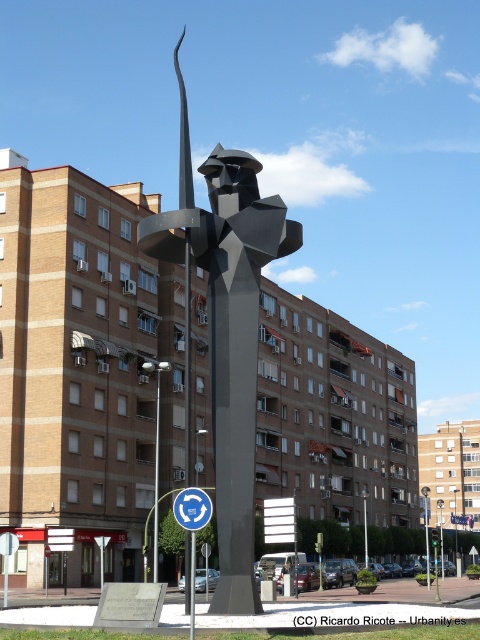
Is polished steel sculpture at center positioned in front of blue circular sign at center?

No, it is not.

Is polished steel sculpture at center positioned behind blue circular sign at center?

Yes, polished steel sculpture at center is further from the viewer.

Does point (223, 241) come in front of point (187, 525)?

No, (223, 241) is behind (187, 525).

What are the coordinates of `polished steel sculpture at center` in the screenshot? It's located at [228, 330].